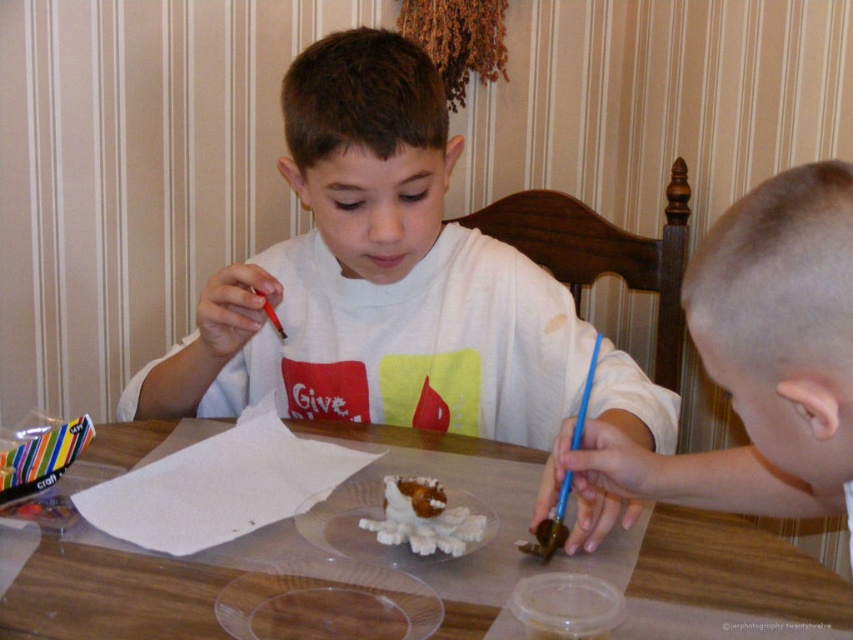
Is white matte shirt at center to the right of white fluffy cake at center from the viewer's perspective?

Incorrect, white matte shirt at center is not on the right side of white fluffy cake at center.

Which is in front, point (259, 285) or point (438, 488)?

Point (438, 488) is in front.

Is point (323, 61) positioned in front of point (439, 516)?

No, it is not.

You are a GUI agent. You are given a task and a screenshot of the screen. Output one action in this format:
    pyautogui.click(x=<x>, y=<y>)
    Task: Click on the white matte shirt at center
    This screenshot has width=853, height=640.
    Given the screenshot: What is the action you would take?
    pyautogui.click(x=376, y=278)

Can you confirm if transparent plastic table at center is positioned to the right of white fluffy cake at center?

Incorrect, transparent plastic table at center is not on the right side of white fluffy cake at center.

Who is more distant from viewer, [213,568] or [462,547]?

The point [462,547] is behind.

Does point (460, 624) come behind point (386, 522)?

No, it is in front of (386, 522).

I want to click on transparent plastic table at center, so click(x=109, y=595).

Is the position of blonde hair at right less distant than that of white fluffy cake at center?

Yes, it is in front of white fluffy cake at center.

This screenshot has width=853, height=640. Describe the element at coordinates (759, 360) in the screenshot. I see `blonde hair at right` at that location.

This screenshot has width=853, height=640. I want to click on blonde hair at right, so click(x=759, y=360).